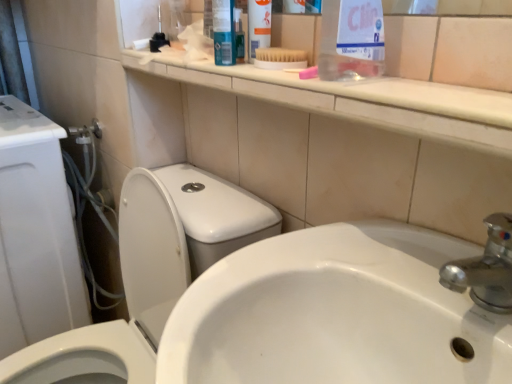
Question: Considering the relative sizes of clear plastic bottle at upper center and white glossy toilet at left in the image provided, is clear plastic bottle at upper center wider than white glossy toilet at left?

Choices:
 (A) no
 (B) yes

Answer: (A)

Question: Considering the relative sizes of clear plastic bottle at upper center and white glossy toilet at left in the image provided, is clear plastic bottle at upper center shorter than white glossy toilet at left?

Choices:
 (A) yes
 (B) no

Answer: (A)

Question: Is clear plastic bottle at upper center facing away from white glossy toilet at left?

Choices:
 (A) yes
 (B) no

Answer: (B)

Question: Is clear plastic bottle at upper center oriented towards white glossy toilet at left?

Choices:
 (A) yes
 (B) no

Answer: (B)

Question: Can you see clear plastic bottle at upper center touching white glossy toilet at left?

Choices:
 (A) yes
 (B) no

Answer: (B)

Question: Is clear plastic bottle at upper center far from white glossy toilet at left?

Choices:
 (A) no
 (B) yes

Answer: (A)

Question: Is white plastic brush at upper center taller than clear plastic bottle at upper center?

Choices:
 (A) yes
 (B) no

Answer: (B)

Question: Is the depth of white plastic brush at upper center less than that of clear plastic bottle at upper center?

Choices:
 (A) yes
 (B) no

Answer: (B)

Question: Considering the relative sizes of white plastic brush at upper center and clear plastic bottle at upper center in the image provided, is white plastic brush at upper center thinner than clear plastic bottle at upper center?

Choices:
 (A) yes
 (B) no

Answer: (A)

Question: From the image's perspective, would you say white plastic brush at upper center is positioned over clear plastic bottle at upper center?

Choices:
 (A) yes
 (B) no

Answer: (A)

Question: Is white plastic brush at upper center wider than clear plastic bottle at upper center?

Choices:
 (A) no
 (B) yes

Answer: (A)

Question: Is white plastic brush at upper center not near clear plastic bottle at upper center?

Choices:
 (A) no
 (B) yes

Answer: (A)

Question: From the image's perspective, is white plastic brush at upper center located beneath white glossy toilet at left?

Choices:
 (A) no
 (B) yes

Answer: (A)